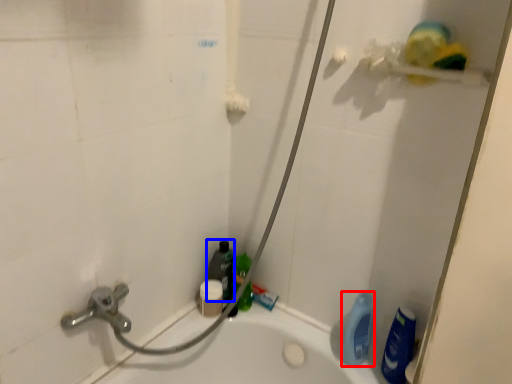
Question: Which object appears closest to the camera in this image, cleaning product (highlighted by a red box) or cleaning product (highlighted by a blue box)?

Choices:
 (A) cleaning product
 (B) cleaning product

Answer: (A)